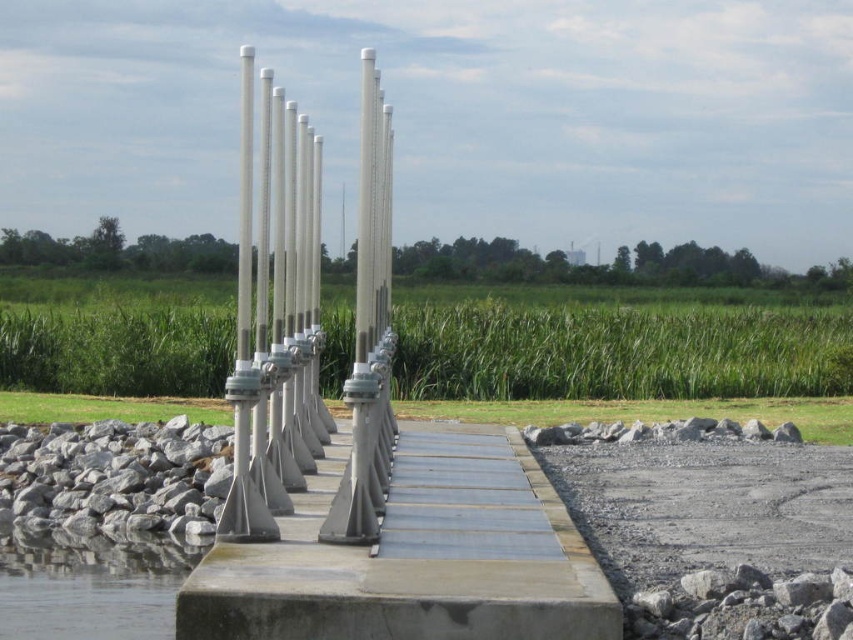
Question: Is the position of smooth concrete dock at center less distant than that of white metallic pole at center?

Choices:
 (A) yes
 (B) no

Answer: (A)

Question: Which of the following is the closest to the observer?

Choices:
 (A) (461, 444)
 (B) (265, 448)
 (C) (479, 524)

Answer: (C)

Question: Which is farther from the clear water at lower left?

Choices:
 (A) metallic gray boardwalk at center
 (B) smooth concrete dock at center

Answer: (A)

Question: From the image, what is the correct spatial relationship of metallic gray boardwalk at center in relation to clear water at lower left?

Choices:
 (A) below
 (B) above

Answer: (B)

Question: Which object is farther from the camera taking this photo?

Choices:
 (A) clear water at lower left
 (B) metallic gray boardwalk at center
 (C) smooth concrete dock at center

Answer: (B)

Question: Does white metallic pole at center have a smaller size compared to clear water at lower left?

Choices:
 (A) yes
 (B) no

Answer: (B)